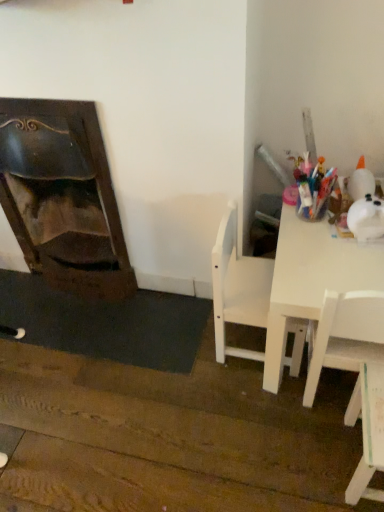
The height and width of the screenshot is (512, 384). In order to click on white matte chair at center, placed as the first chair when sorted from left to right in this screenshot , I will do `click(238, 288)`.

Image resolution: width=384 pixels, height=512 pixels. In order to click on white matte chair at lower right, positioned as the 2th chair in left-to-right order in this screenshot , I will do `click(367, 431)`.

You are a GUI agent. You are given a task and a screenshot of the screen. Output one action in this format:
    pyautogui.click(x=<x>, y=<y>)
    Task: Click on the white matte chair at center, placed as the first chair when sorted from left to right
    This screenshot has width=384, height=512.
    Given the screenshot: What is the action you would take?
    pyautogui.click(x=238, y=288)

Would you say white matte chair at center, marked as the 2th chair in a right-to-left arrangement, is to the left or to the right of white matte chair at lower right, marked as the first chair in a right-to-left arrangement, in the picture?

white matte chair at center, marked as the 2th chair in a right-to-left arrangement, is positioned on white matte chair at lower right, marked as the first chair in a right-to-left arrangement,'s left side.

Considering their positions, is white matte chair at center, marked as the 2th chair in a right-to-left arrangement, located in front of or behind white matte chair at lower right, marked as the first chair in a right-to-left arrangement?

Clearly, white matte chair at center, marked as the 2th chair in a right-to-left arrangement, is behind white matte chair at lower right, marked as the first chair in a right-to-left arrangement.

Does white matte chair at center, marked as the 2th chair in a right-to-left arrangement, touch white matte chair at lower right, marked as the first chair in a right-to-left arrangement?

No, white matte chair at center, marked as the 2th chair in a right-to-left arrangement, is not next to white matte chair at lower right, marked as the first chair in a right-to-left arrangement.

Can you confirm if white matte chair at center, placed as the first chair when sorted from left to right, is shorter than white matte chair at lower right, marked as the first chair in a right-to-left arrangement?

No.

How far apart are white glossy table at right and white matte chair at center, marked as the 2th chair in a right-to-left arrangement?

white glossy table at right is 6.63 inches away from white matte chair at center, marked as the 2th chair in a right-to-left arrangement.

From a real-world perspective, who is located higher, white glossy table at right or white matte chair at center, marked as the 2th chair in a right-to-left arrangement?

white matte chair at center, marked as the 2th chair in a right-to-left arrangement, from a real-world perspective.

In the image, is white glossy table at right positioned in front of or behind white matte chair at center, placed as the first chair when sorted from left to right?

Visually, white glossy table at right is located in front of white matte chair at center, placed as the first chair when sorted from left to right.

Is white glossy table at right directly adjacent to white matte chair at center, placed as the first chair when sorted from left to right?

No, white glossy table at right is not beside white matte chair at center, placed as the first chair when sorted from left to right.

Is white matte chair at center, marked as the 2th chair in a right-to-left arrangement, far away from dark wood fireplace at left?

white matte chair at center, marked as the 2th chair in a right-to-left arrangement, is near dark wood fireplace at left, not far away.

Between white matte chair at center, marked as the 2th chair in a right-to-left arrangement, and dark wood fireplace at left, which one appears on the left side from the viewer's perspective?

Positioned to the left is dark wood fireplace at left.

In the scene shown: Is white matte chair at center, placed as the first chair when sorted from left to right, oriented towards dark wood fireplace at left?

No, white matte chair at center, placed as the first chair when sorted from left to right, is not facing towards dark wood fireplace at left.

From a real-world perspective, is white matte chair at center, marked as the 2th chair in a right-to-left arrangement, below dark wood fireplace at left?

Yes, from a real-world perspective, white matte chair at center, marked as the 2th chair in a right-to-left arrangement, is beneath dark wood fireplace at left.

Is dark wood fireplace at left taller or shorter than white matte chair at lower right, marked as the first chair in a right-to-left arrangement?

dark wood fireplace at left is taller than white matte chair at lower right, marked as the first chair in a right-to-left arrangement.

Could you tell me if dark wood fireplace at left is facing white matte chair at lower right, positioned as the 2th chair in left-to-right order?

No, dark wood fireplace at left is not turned towards white matte chair at lower right, positioned as the 2th chair in left-to-right order.

Is the depth of dark wood fireplace at left less than that of white matte chair at lower right, positioned as the 2th chair in left-to-right order?

No, the depth of dark wood fireplace at left is greater than that of white matte chair at lower right, positioned as the 2th chair in left-to-right order.

From a real-world perspective, is dark wood fireplace at left physically below white matte chair at lower right, marked as the first chair in a right-to-left arrangement?

No.

Does white matte chair at lower right, positioned as the 2th chair in left-to-right order, have a smaller size compared to white matte chair at center, marked as the 2th chair in a right-to-left arrangement?

Yes.

Locate an element on the screen. chair lying on the left of white matte chair at lower right, positioned as the 2th chair in left-to-right order is located at coordinates (238, 288).

Based on the photo, is white matte chair at lower right, marked as the first chair in a right-to-left arrangement, oriented away from white matte chair at center, marked as the 2th chair in a right-to-left arrangement?

No, white matte chair at lower right, marked as the first chair in a right-to-left arrangement, is not facing away from white matte chair at center, marked as the 2th chair in a right-to-left arrangement.

From a real-world perspective, is white matte chair at lower right, marked as the first chair in a right-to-left arrangement, on white matte chair at center, placed as the first chair when sorted from left to right?

No, from a real-world perspective, white matte chair at lower right, marked as the first chair in a right-to-left arrangement, is not above white matte chair at center, placed as the first chair when sorted from left to right.

Identify the location of table below the dark wood fireplace at left (from a real-world perspective). This screenshot has width=384, height=512. (312, 280).

Is white glossy table at right located outside dark wood fireplace at left?

white glossy table at right lies outside dark wood fireplace at left's area.

Considering the sizes of objects white glossy table at right and dark wood fireplace at left in the image provided, who is bigger, white glossy table at right or dark wood fireplace at left?

Bigger between the two is white glossy table at right.

From a real-world perspective, is white matte chair at lower right, marked as the first chair in a right-to-left arrangement, above or below dark wood fireplace at left?

From a real-world perspective, white matte chair at lower right, marked as the first chair in a right-to-left arrangement, is physically below dark wood fireplace at left.

From the image's perspective, is white matte chair at lower right, positioned as the 2th chair in left-to-right order, positioned above or below dark wood fireplace at left?

Clearly, from the image's perspective, white matte chair at lower right, positioned as the 2th chair in left-to-right order, is below dark wood fireplace at left.

Is white matte chair at lower right, marked as the first chair in a right-to-left arrangement, positioned in front of dark wood fireplace at left?

Yes, white matte chair at lower right, marked as the first chair in a right-to-left arrangement, is closer to the camera.

Locate an element on the screen. Image resolution: width=384 pixels, height=512 pixels. chair behind the white matte chair at lower right, positioned as the 2th chair in left-to-right order is located at coordinates (238, 288).

I want to click on table that is under the white matte chair at center, placed as the first chair when sorted from left to right (from a real-world perspective), so click(x=312, y=280).

Which object lies further to the anchor point white matte chair at lower right, positioned as the 2th chair in left-to-right order, white glossy table at right or dark wood fireplace at left?

dark wood fireplace at left is positioned further to the anchor white matte chair at lower right, positioned as the 2th chair in left-to-right order.

Based on the photo, which object lies nearer to the anchor point white glossy table at right, white matte chair at lower right, marked as the first chair in a right-to-left arrangement, or white matte chair at center, marked as the 2th chair in a right-to-left arrangement?

white matte chair at center, marked as the 2th chair in a right-to-left arrangement, lies closer to white glossy table at right than the other object.

In the scene shown: From the image, which object appears to be nearer to white matte chair at center, marked as the 2th chair in a right-to-left arrangement, white glossy table at right or white matte chair at lower right, marked as the first chair in a right-to-left arrangement?

Based on the image, white glossy table at right appears to be nearer to white matte chair at center, marked as the 2th chair in a right-to-left arrangement.

From the image, which object appears to be nearer to dark wood fireplace at left, white matte chair at center, placed as the first chair when sorted from left to right, or white matte chair at lower right, marked as the first chair in a right-to-left arrangement?

The object closer to dark wood fireplace at left is white matte chair at center, placed as the first chair when sorted from left to right.

Based on their spatial positions, is white matte chair at center, marked as the 2th chair in a right-to-left arrangement, or white matte chair at lower right, marked as the first chair in a right-to-left arrangement, closer to white glossy table at right?

The object closer to white glossy table at right is white matte chair at center, marked as the 2th chair in a right-to-left arrangement.

From the image, which object appears to be farther from dark wood fireplace at left, white matte chair at lower right, marked as the first chair in a right-to-left arrangement, or white glossy table at right?

white matte chair at lower right, marked as the first chair in a right-to-left arrangement.

Estimate the real-world distances between objects in this image. Which object is closer to dark wood fireplace at left, white glossy table at right or white matte chair at center, marked as the 2th chair in a right-to-left arrangement?

white matte chair at center, marked as the 2th chair in a right-to-left arrangement, is closer to dark wood fireplace at left.

Based on their spatial positions, is dark wood fireplace at left or white glossy table at right closer to white matte chair at lower right, marked as the first chair in a right-to-left arrangement?

white glossy table at right is positioned closer to the anchor white matte chair at lower right, marked as the first chair in a right-to-left arrangement.

Find the location of a particular element. table between white matte chair at lower right, marked as the first chair in a right-to-left arrangement, and white matte chair at center, placed as the first chair when sorted from left to right, along the z-axis is located at coordinates (312, 280).

Identify the location of chair located between dark wood fireplace at left and white matte chair at lower right, marked as the first chair in a right-to-left arrangement, in the left-right direction. The height and width of the screenshot is (512, 384). (238, 288).